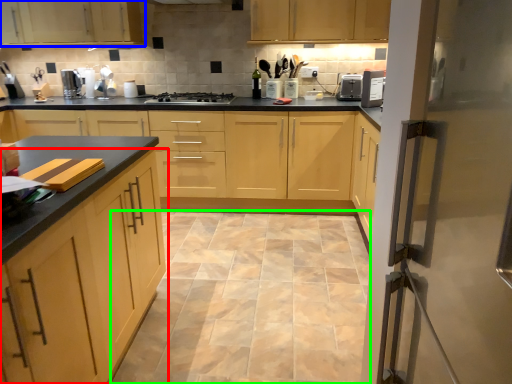
Question: Estimate the real-world distances between objects in this image. Which object is farther from cabinetry (highlighted by a red box), cabinetry (highlighted by a blue box) or ceramic tile (highlighted by a green box)?

Choices:
 (A) cabinetry
 (B) ceramic tile

Answer: (A)